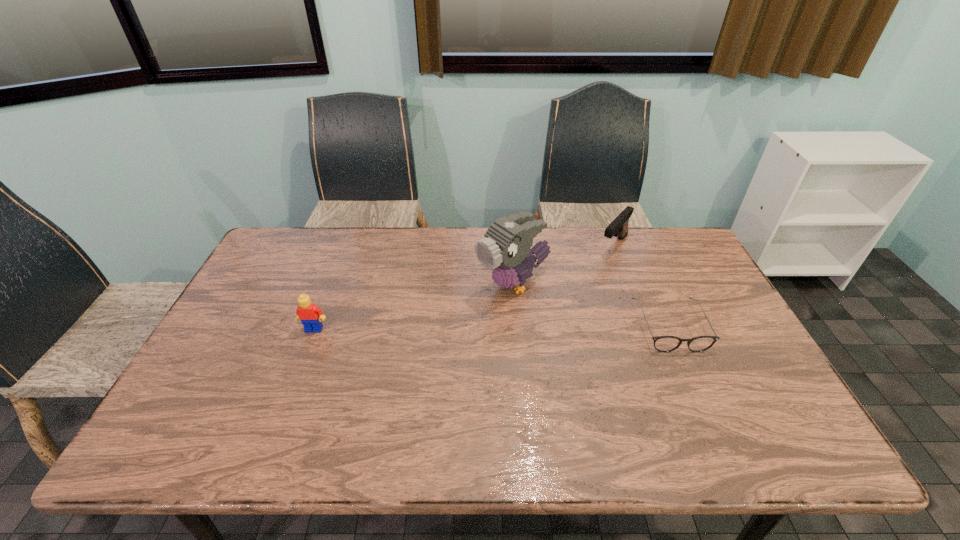
Where is `blank area at the far right corner`? This screenshot has width=960, height=540. blank area at the far right corner is located at coordinates (668, 240).

Image resolution: width=960 pixels, height=540 pixels. In the image, there is a desktop. What are the coordinates of `vacant space at the near right corner` in the screenshot? It's located at (753, 400).

Locate an element on the screen. This screenshot has height=540, width=960. vacant area that lies between the tallest object and the pistol is located at coordinates (564, 265).

Image resolution: width=960 pixels, height=540 pixels. What are the coordinates of `vacant space that is in between the farthest object and the spectacles` in the screenshot? It's located at (641, 286).

Locate an element on the screen. The image size is (960, 540). free space between the farthest object and the shortest object is located at coordinates (641, 286).

At what (x,y) coordinates should I click in order to perform the action: click on free space between the shortest object and the Lego. Please return your answer as a coordinate pair (x, y). This screenshot has height=540, width=960. Looking at the image, I should click on tap(492, 328).

Where is `free space between the bird and the shortest object`? This screenshot has height=540, width=960. free space between the bird and the shortest object is located at coordinates (591, 306).

Where is `vacant area between the bird and the Lego`? The width and height of the screenshot is (960, 540). vacant area between the bird and the Lego is located at coordinates (414, 307).

The image size is (960, 540). I want to click on empty location between the spectacles and the third object from right to left, so click(x=591, y=306).

This screenshot has width=960, height=540. I want to click on vacant space that's between the farthest object and the spectacles, so click(641, 286).